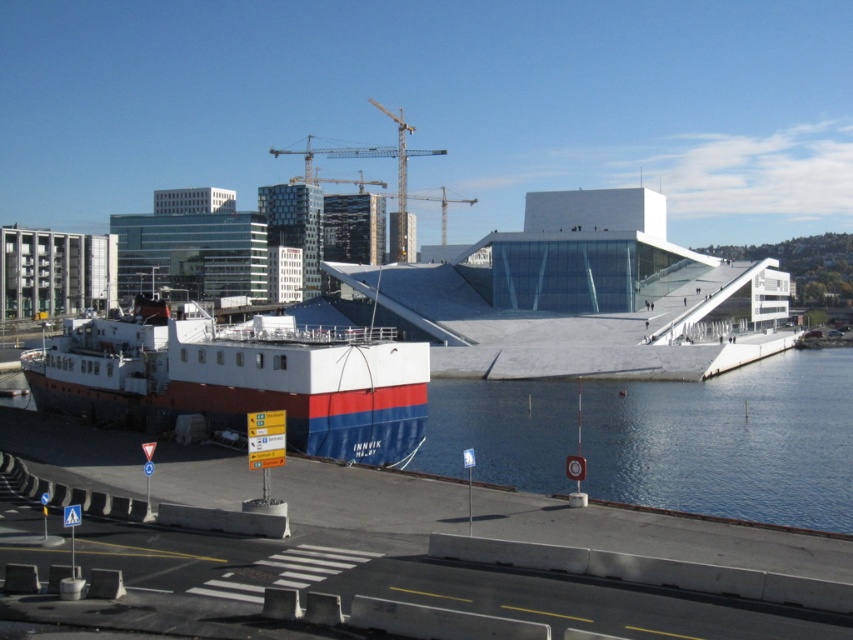
Describe the element at coordinates (241, 378) in the screenshot. The image size is (853, 640). I see `white matte boat at lower left` at that location.

Which of these two, white matte boat at lower left or metallic yellow crane at upper center, stands taller?

With more height is metallic yellow crane at upper center.

Is point (273, 352) closer to camera compared to point (341, 154)?

That is True.

Find the location of a particular element. white matte boat at lower left is located at coordinates (241, 378).

Is point (706, 404) farther from viewer compared to point (352, 148)?

No, it is in front of (352, 148).

Can you confirm if clear blue water at center is positioned above metallic yellow crane at upper center?

Incorrect, clear blue water at center is not positioned above metallic yellow crane at upper center.

Which is behind, point (531, 428) or point (405, 234)?

Positioned behind is point (405, 234).

Where is `clear blue water at center`? clear blue water at center is located at coordinates (730, 442).

Does clear blue water at center appear on the right side of white matte boat at lower left?

Indeed, clear blue water at center is positioned on the right side of white matte boat at lower left.

Can you confirm if clear blue water at center is positioned below white matte boat at lower left?

Indeed, clear blue water at center is positioned under white matte boat at lower left.

Locate an element on the screen. clear blue water at center is located at coordinates (730, 442).